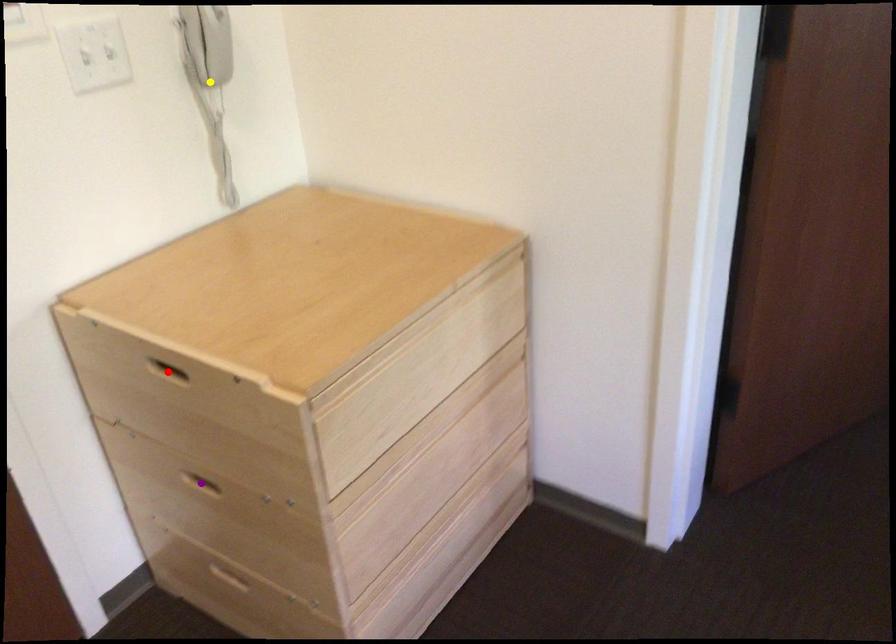
Based on the photo, order these from nearest to farthest:
red point | yellow point | purple point

red point, purple point, yellow point